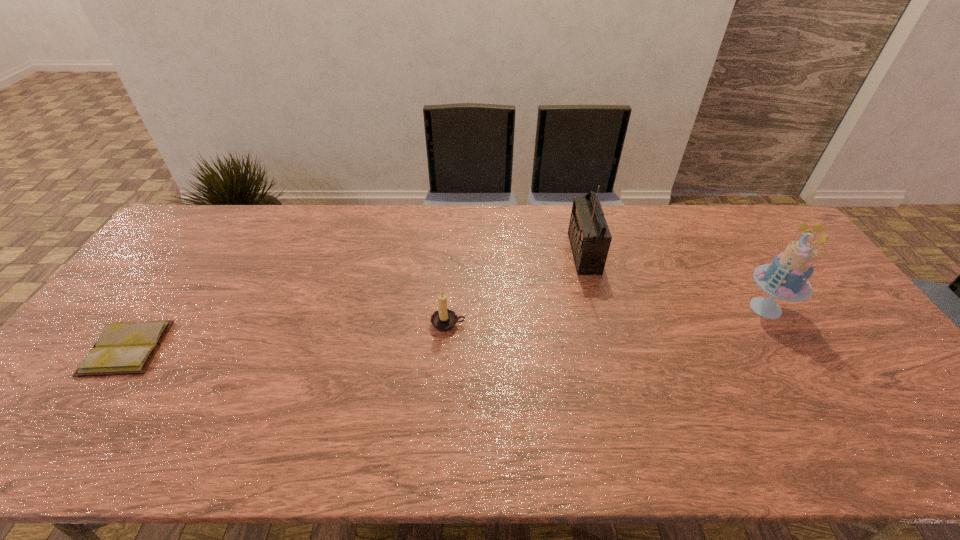
The image size is (960, 540). I want to click on free space located with a ladder on the side of the rightmost object, so (709, 308).

In order to click on vacant space located with a ladder on the side of the rightmost object in this screenshot , I will do `click(664, 308)`.

The height and width of the screenshot is (540, 960). Identify the location of free spot located 0.070m with a ladder on the side of the rightmost object. (716, 308).

I want to click on vacant space situated on the wick of the third tallest object, so click(443, 411).

The height and width of the screenshot is (540, 960). I want to click on vacant space positioned on the front of the shortest object, so click(x=84, y=410).

You are a GUI agent. You are given a task and a screenshot of the screen. Output one action in this format:
    pyautogui.click(x=<x>, y=<y>)
    Task: Click on the object at the far edge
    
    Given the screenshot: What is the action you would take?
    pyautogui.click(x=589, y=235)

Where is `object located at the left edge`? object located at the left edge is located at coordinates (122, 348).

Where is `object at the right edge`? This screenshot has width=960, height=540. object at the right edge is located at coordinates (786, 277).

What are the coordinates of `vacant space at the far edge` in the screenshot? It's located at (330, 223).

In order to click on vacant region at the near edge of the desktop in this screenshot , I will do `click(419, 457)`.